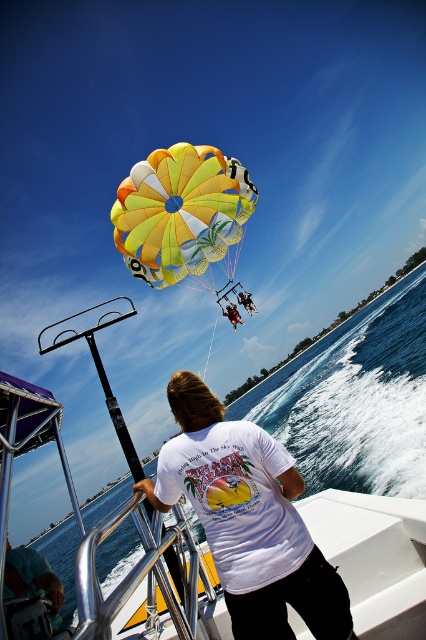
Question: Which of the following is the closest to the observer?

Choices:
 (A) white cotton t-shirt at center
 (B) white t-shirt at center
 (C) yellow fabric parachute at upper center

Answer: (A)

Question: Where is yellow fabric parachute at upper center located in relation to white t-shirt at center in the image?

Choices:
 (A) above
 (B) below

Answer: (A)

Question: Observing the image, what is the correct spatial positioning of white cotton t-shirt at center in reference to yellow fabric parachute at upper center?

Choices:
 (A) left
 (B) right

Answer: (B)

Question: Which point is closer to the camera?

Choices:
 (A) (236, 323)
 (B) (310, 596)

Answer: (B)

Question: Is white cotton t-shirt at center positioned in front of white t-shirt at center?

Choices:
 (A) yes
 (B) no

Answer: (A)

Question: Which object appears closest to the camera in this image?

Choices:
 (A) yellow fabric parachute at upper center
 (B) white cotton t-shirt at center
 (C) white t-shirt at center

Answer: (B)